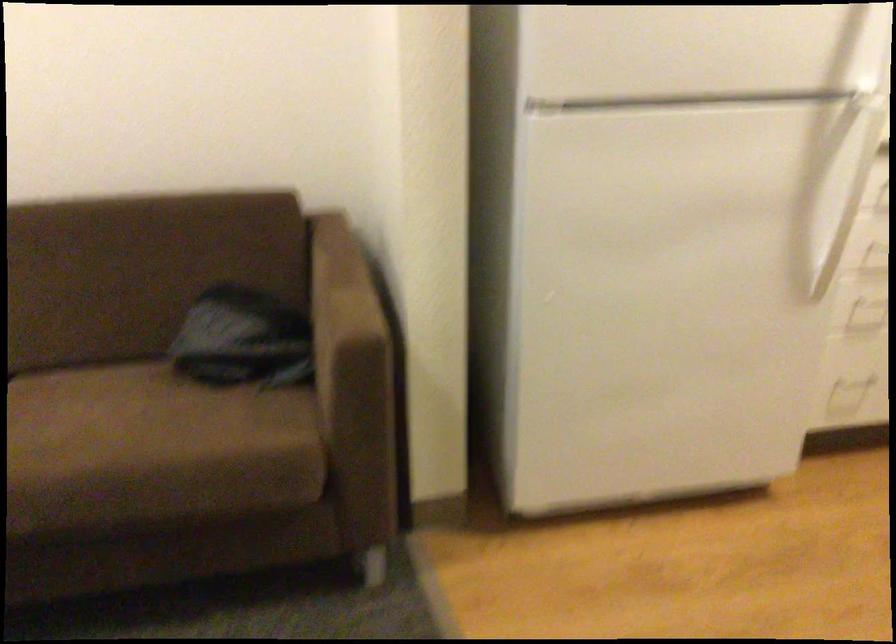
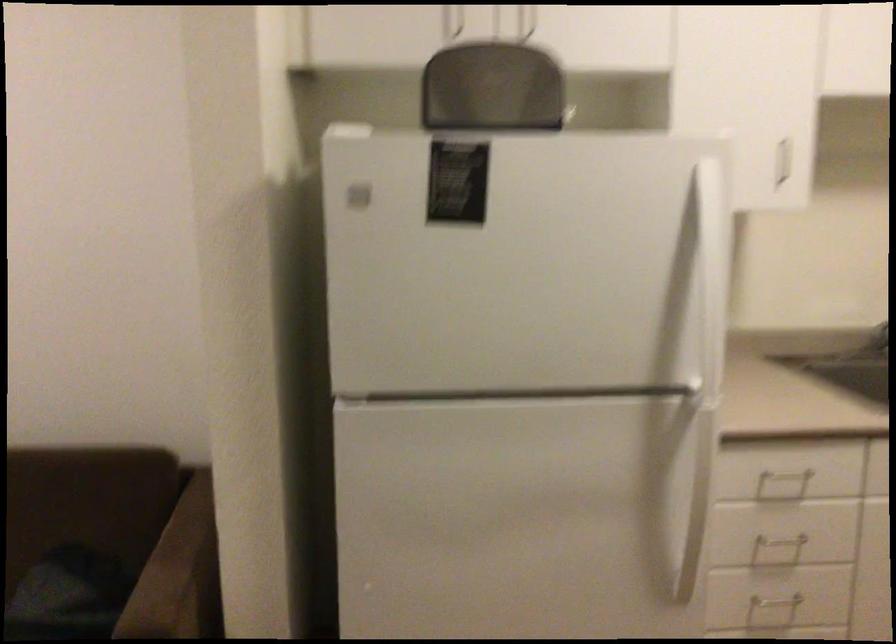
Question: The images are taken continuously from a first-person perspective. In which direction are you moving?

Choices:
 (A) Left
 (B) Right
 (C) Forward
 (D) Backward

Answer: (B)